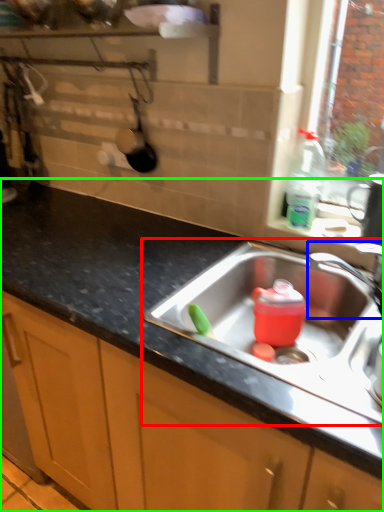
Question: Estimate the real-world distances between objects in this image. Which object is closer to sink (highlighted by a red box), tap (highlighted by a blue box) or countertop (highlighted by a green box)?

Choices:
 (A) tap
 (B) countertop

Answer: (A)